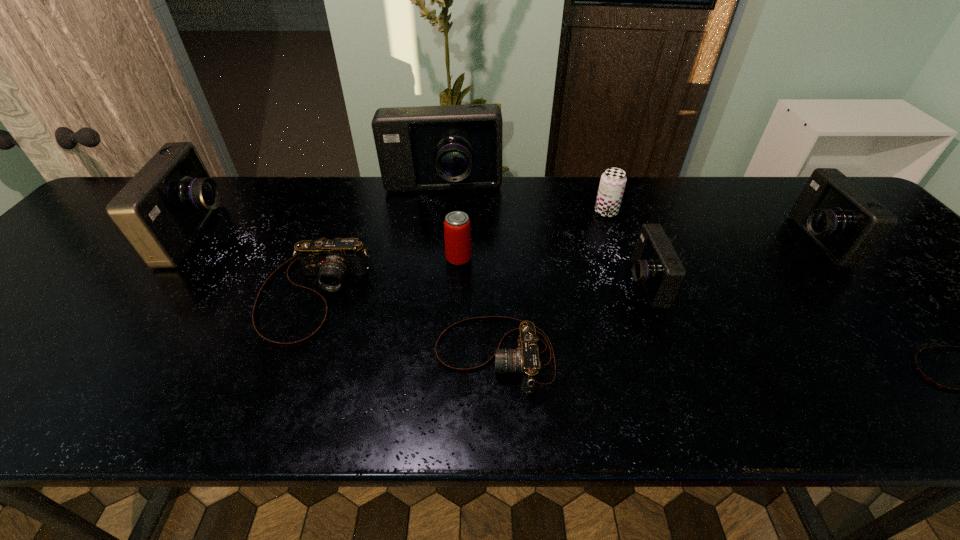
Identify which brown camera is the second closest to the eighth shortest object. Please provide its 2D coordinates. Your answer should be formatted as a tuple, i.e. [(x, y)], where the tuple contains the x and y coordinates of a point satisfying the conditions above.

[(524, 360)]

Locate which brown camera is the closest to the second blue camera from left to right. Please provide its 2D coordinates. Your answer should be formatted as a tuple, i.e. [(x, y)], where the tuple contains the x and y coordinates of a point satisfying the conditions above.

[(331, 261)]